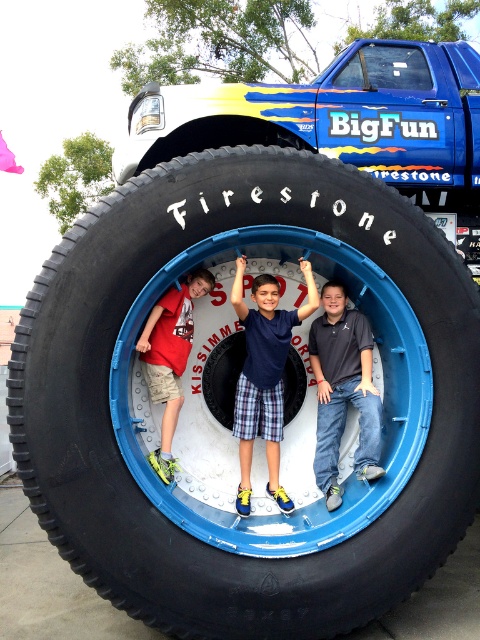
You are a photographer trying to capture a shot of the black rubber tire at center and the dark gray cotton shirt at center. Based on their sizes, which object should you focus on first if you want to ensure both are fully visible in the frame?

The black rubber tire at center is taller than the dark gray cotton shirt at center, so you should focus on the black rubber tire at center first to ensure it fits entirely within the frame.

You are a photographer trying to capture a photo of the dark gray cotton shirt at center and the matte red shirt at center inside the tire. Which shirt should you focus on first if you want to ensure both are in focus, considering their heights?

The dark gray cotton shirt at center is taller than the matte red shirt at center, so focusing on the taller dark gray cotton shirt at center first will help ensure both are in focus as the depth of field may cover the shorter matte red shirt at center.

You are a photographer trying to capture a photo of the black rubber tire at center and the blue plaid shorts at center. If you want to ensure both fit in the frame, which object should you focus on to avoid cropping?

The black rubber tire at center is wider than the blue plaid shorts at center. To ensure both fit in the frame, focus on the black rubber tire at center as it has the greater width.